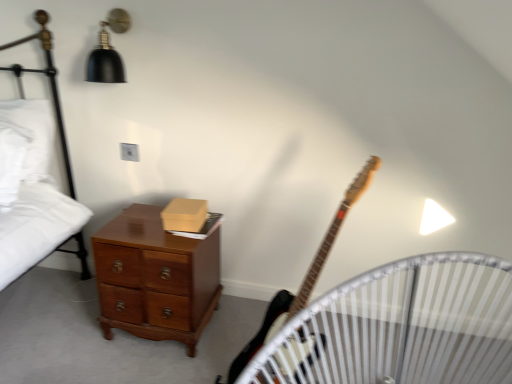
Where is `free spot to the left of mahogany wooden chest of drawers at lower left`? free spot to the left of mahogany wooden chest of drawers at lower left is located at coordinates (61, 322).